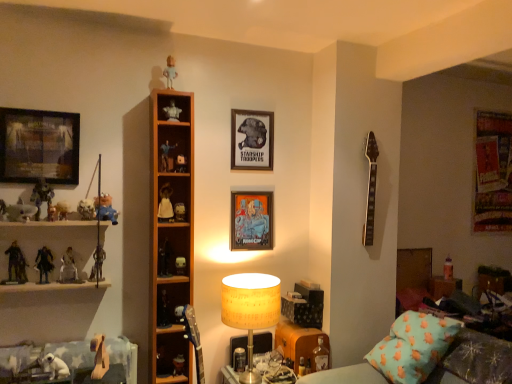
Question: Can you confirm if white matte figurine at upper center, which ranks as the sixth toy in right-to-left order, is taller than matte paper picture frame at center, the 2th picture frame when ordered from back to front?

Choices:
 (A) no
 (B) yes

Answer: (A)

Question: Is white matte figurine at upper center, which is counted as the 14th toy, starting from the left, oriented towards matte paper picture frame at center, placed as the 3th picture frame when sorted from left to right?

Choices:
 (A) no
 (B) yes

Answer: (A)

Question: Is white matte figurine at upper center, which ranks as the sixth toy in right-to-left order, at the left side of matte paper picture frame at center, the 3th picture frame in the front-to-back sequence?

Choices:
 (A) no
 (B) yes

Answer: (B)

Question: Does white matte figurine at upper center, which is counted as the 14th toy, starting from the left, have a lesser height compared to matte paper picture frame at center, the 3th picture frame in the front-to-back sequence?

Choices:
 (A) yes
 (B) no

Answer: (A)

Question: From a real-world perspective, is white matte figurine at upper center, which is counted as the 14th toy, starting from the left, positioned under matte paper picture frame at center, the 2th picture frame when ordered from back to front, based on gravity?

Choices:
 (A) yes
 (B) no

Answer: (B)

Question: From the image's perspective, relative to matte plastic action figure at left, the fifth toy positioned from the left, is white paper lampshade at center above or below?

Choices:
 (A) below
 (B) above

Answer: (A)

Question: From their relative heights in the image, would you say white paper lampshade at center is taller or shorter than matte plastic action figure at left, the fifth toy positioned from the left?

Choices:
 (A) tall
 (B) short

Answer: (A)

Question: From a real-world perspective, is white paper lampshade at center physically located above or below matte plastic action figure at left, which is counted as the 15th toy, starting from the right?

Choices:
 (A) above
 (B) below

Answer: (B)

Question: Considering the positions of white paper lampshade at center and matte plastic action figure at left, which is counted as the 15th toy, starting from the right, in the image, is white paper lampshade at center bigger or smaller than matte plastic action figure at left, which is counted as the 15th toy, starting from the right,?

Choices:
 (A) big
 (B) small

Answer: (A)

Question: Is point (98, 256) closer or farther from the camera than point (6, 249)?

Choices:
 (A) farther
 (B) closer

Answer: (A)

Question: Relative to metallic silver figure at left, which is counted as the 18th toy, starting from the right, is metallic silver figure at left, which is counted as the 8th toy, starting from the left, in front or behind?

Choices:
 (A) front
 (B) behind

Answer: (B)

Question: From their relative heights in the image, would you say metallic silver figure at left, which is counted as the 8th toy, starting from the left, is taller or shorter than metallic silver figure at left, which is counted as the 18th toy, starting from the right?

Choices:
 (A) tall
 (B) short

Answer: (B)

Question: Is metallic silver figure at left, which is counted as the 8th toy, starting from the left, wider or thinner than metallic silver figure at left, which is counted as the 18th toy, starting from the right?

Choices:
 (A) thin
 (B) wide

Answer: (B)

Question: Is white matte doll at center, acting as the tenth toy starting from the right, situated inside matte black picture frame at upper left, the fourth picture frame from the back, or outside?

Choices:
 (A) inside
 (B) outside

Answer: (B)

Question: Is point (167, 188) positioned closer to the camera than point (64, 175)?

Choices:
 (A) closer
 (B) farther

Answer: (B)